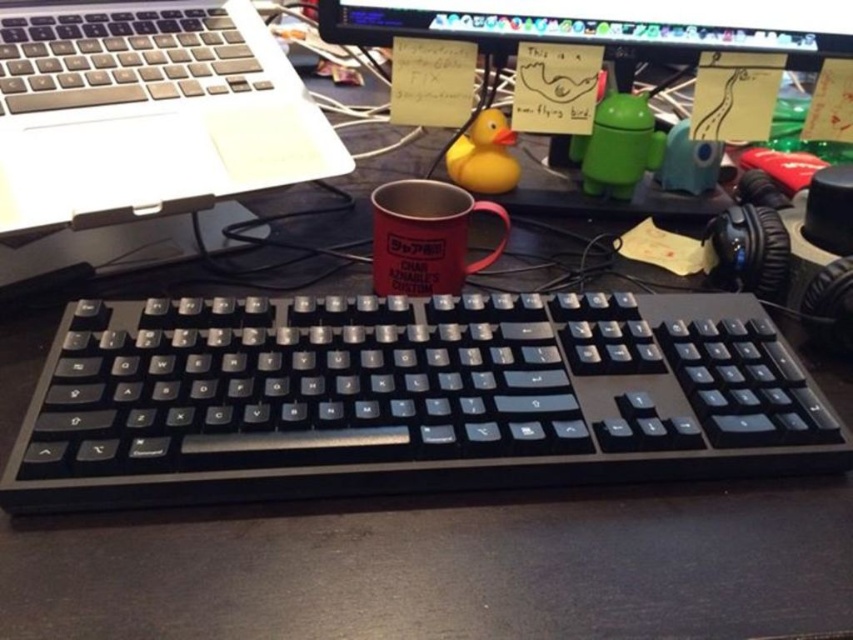
Does matte plastic monitor at upper center have a greater height compared to matte red mug at center?

Yes.

Can you confirm if matte plastic monitor at upper center is bigger than matte red mug at center?

Yes.

Which is behind, point (689, 202) or point (498, 204)?

Positioned behind is point (689, 202).

Locate an element on the screen. This screenshot has width=853, height=640. matte plastic monitor at upper center is located at coordinates (606, 26).

Does silver metallic laptop at upper left appear under matte plastic monitor at upper center?

Correct, silver metallic laptop at upper left is located below matte plastic monitor at upper center.

In the scene shown: Which is below, silver metallic laptop at upper left or matte plastic monitor at upper center?

silver metallic laptop at upper left is lower down.

Find the location of a particular element. The image size is (853, 640). silver metallic laptop at upper left is located at coordinates (146, 109).

Find the location of a particular element. Image resolution: width=853 pixels, height=640 pixels. silver metallic laptop at upper left is located at coordinates (146, 109).

Is silver metallic laptop at upper left wider than matte red mug at center?

Yes, silver metallic laptop at upper left is wider than matte red mug at center.

Is silver metallic laptop at upper left smaller than matte red mug at center?

No, silver metallic laptop at upper left is not smaller than matte red mug at center.

This screenshot has width=853, height=640. Identify the location of silver metallic laptop at upper left. (146, 109).

Where is `silver metallic laptop at upper left`? The height and width of the screenshot is (640, 853). silver metallic laptop at upper left is located at coordinates (146, 109).